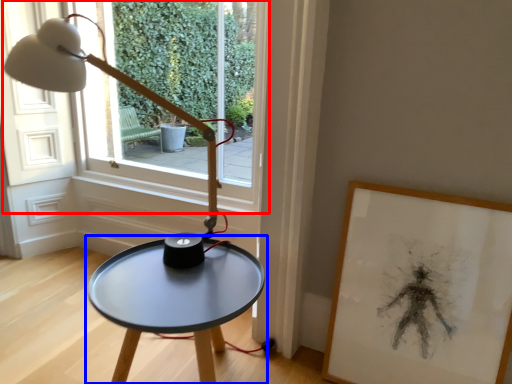
Question: Which of the following is the farthest to the observer, window (highlighted by a red box) or table (highlighted by a blue box)?

Choices:
 (A) window
 (B) table

Answer: (A)